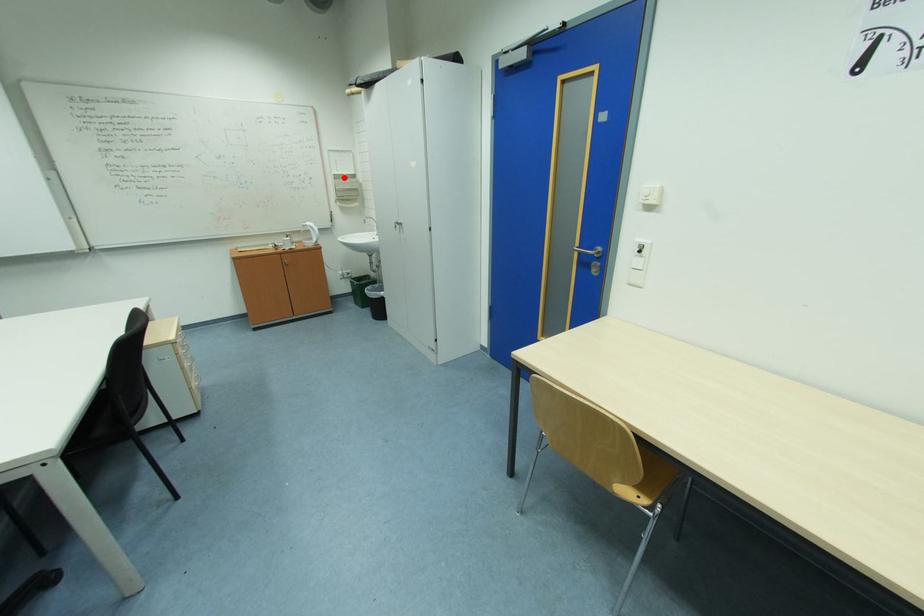
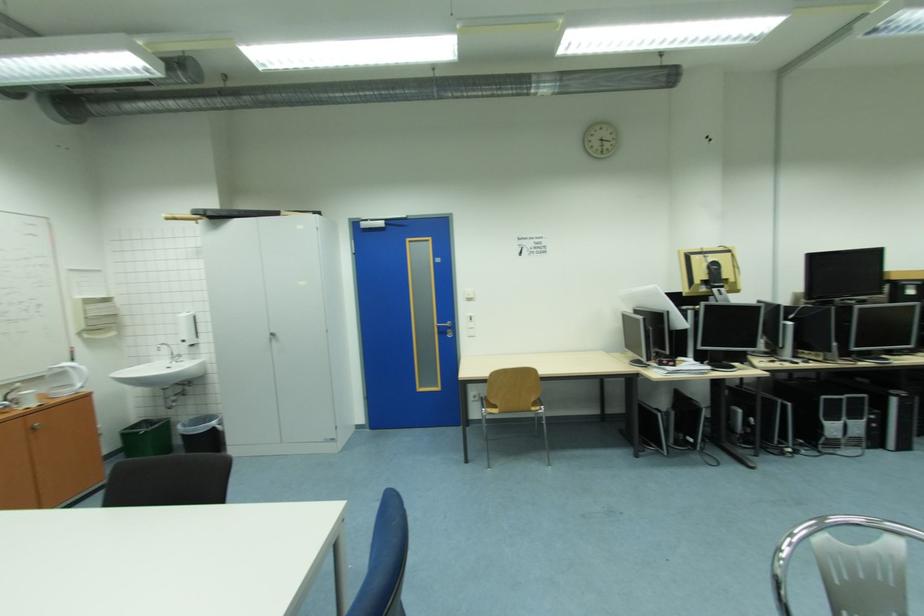
Where in the second image is the point corresponding to the highlighted location from the first image?

(94, 302)